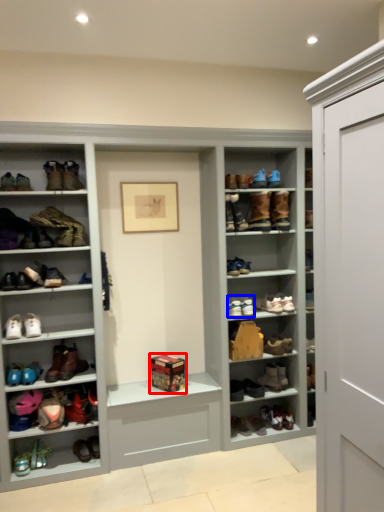
Question: Among these objects, which one is farthest to the camera, box (highlighted by a red box) or shoe (highlighted by a blue box)?

Choices:
 (A) box
 (B) shoe

Answer: (B)